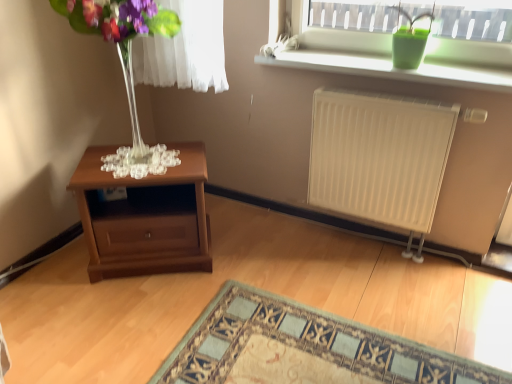
Find the location of a particular element. The width and height of the screenshot is (512, 384). free point in front of white matte radiator at right is located at coordinates (370, 312).